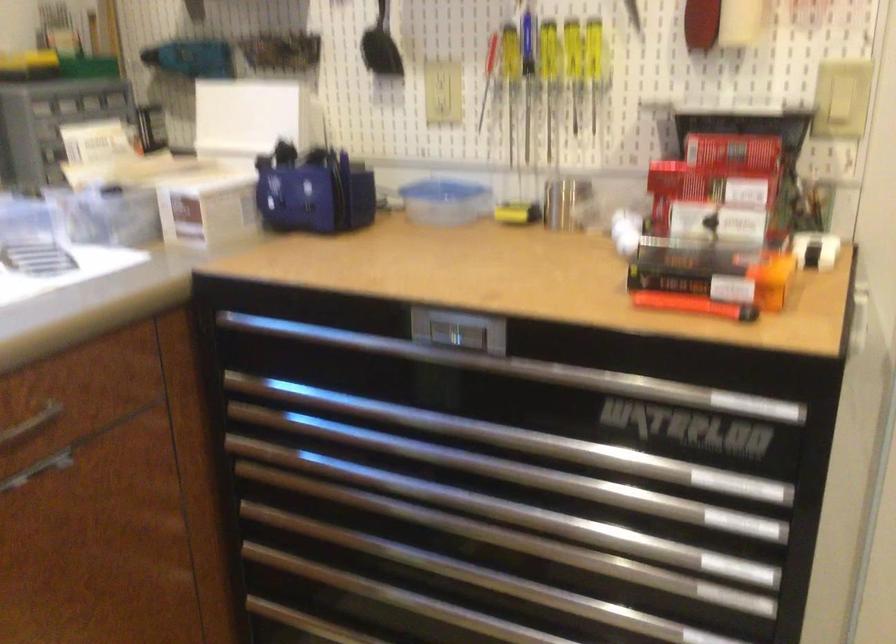
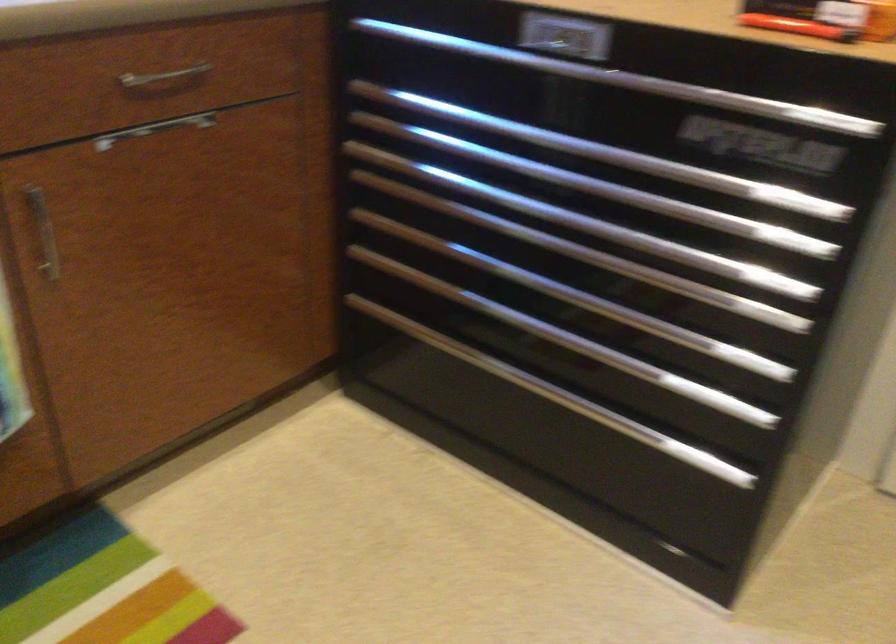
Locate, in the second image, the point that corresponds to pixel 581 375 in the first image.

(668, 88)